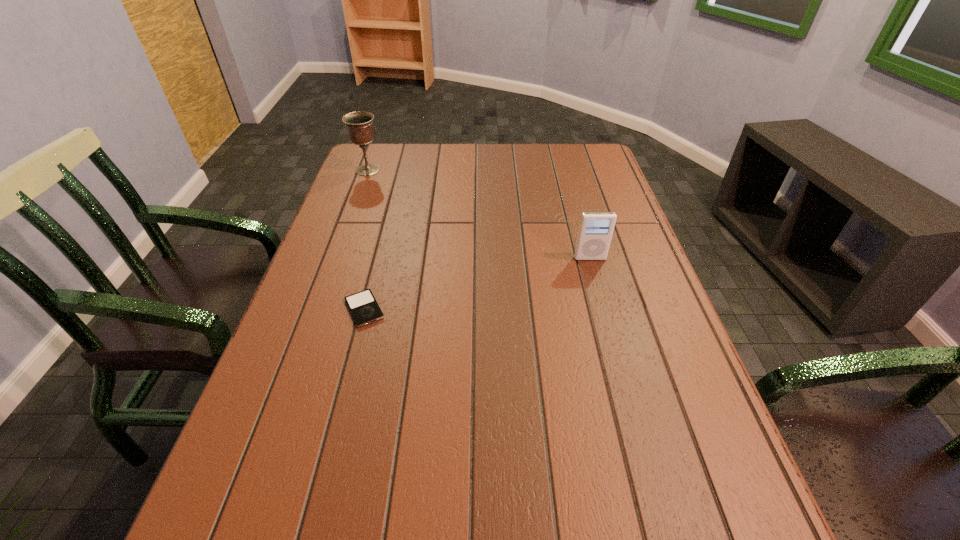
Image resolution: width=960 pixels, height=540 pixels. Find the location of `chalice located in the left edge section of the desktop`. chalice located in the left edge section of the desktop is located at coordinates (359, 125).

Find the location of a particular element. The height and width of the screenshot is (540, 960). iPod that is at the left edge is located at coordinates (363, 306).

At what (x,y) coordinates should I click in order to perform the action: click on object that is positioned at the right edge. Please return your answer as a coordinate pair (x, y). This screenshot has height=540, width=960. Looking at the image, I should click on pos(596,229).

The image size is (960, 540). What are the coordinates of `object at the far left corner` in the screenshot? It's located at (359, 125).

Where is `vacant space at the far edge of the desktop`? This screenshot has width=960, height=540. vacant space at the far edge of the desktop is located at coordinates (406, 173).

This screenshot has height=540, width=960. Find the location of `free space at the left edge of the desktop`. free space at the left edge of the desktop is located at coordinates (299, 402).

Identify the location of vacant space at the right edge of the desktop. (660, 457).

In the image, there is a desktop. Identify the location of vacant space at the far left corner. This screenshot has width=960, height=540. (378, 151).

You are a GUI agent. You are given a task and a screenshot of the screen. Output one action in this format:
    pyautogui.click(x=<x>, y=<y>)
    Task: Click on the free space between the farthest object and the left iPod
    
    Given the screenshot: What is the action you would take?
    pyautogui.click(x=366, y=240)

This screenshot has height=540, width=960. Identify the location of unoccupied area between the left iPod and the farther iPod. (477, 284).